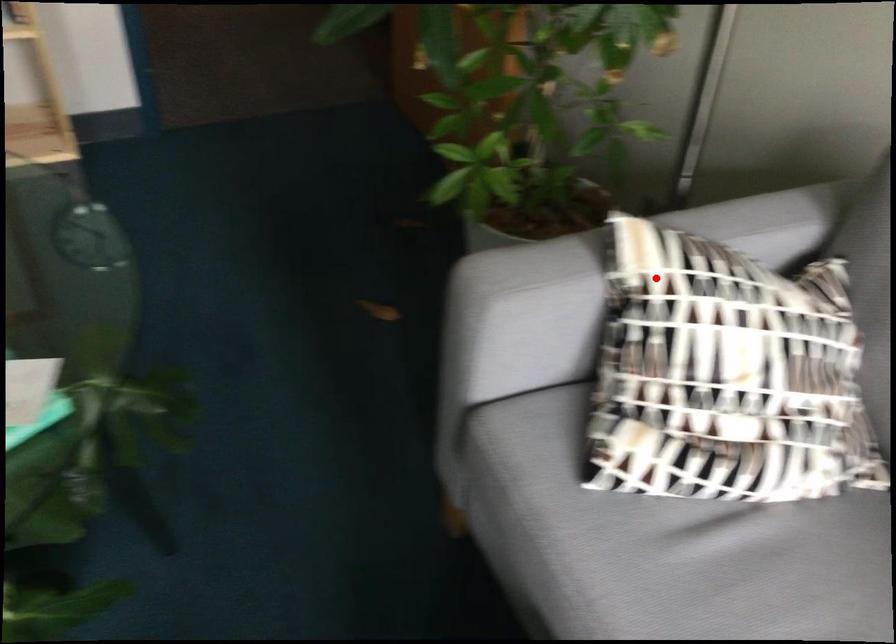
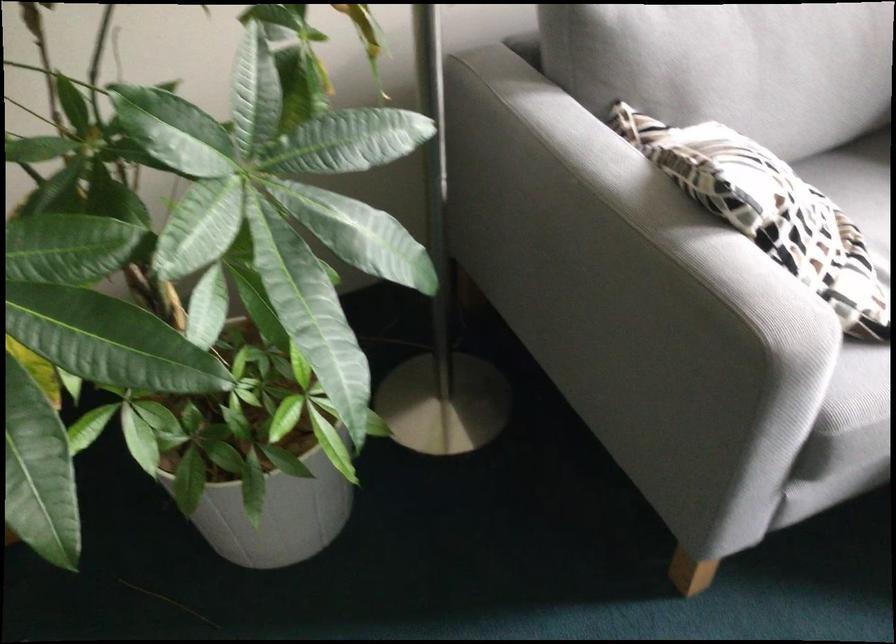
The point at the highlighted location is marked in the first image. Where is the corresponding point in the second image?

(768, 212)